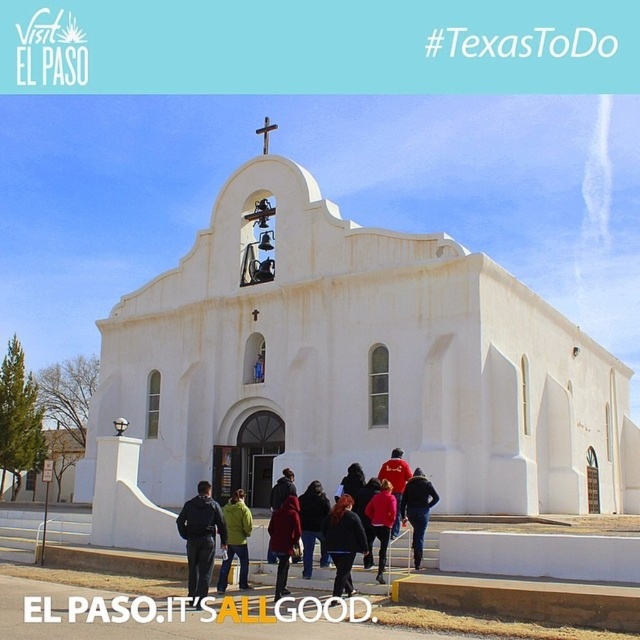
Question: Among these points, which one is nearest to the camera?

Choices:
 (A) (221, 586)
 (B) (326, 260)
 (C) (390, 502)

Answer: (A)

Question: Which point is farther from the camera taking this photo?

Choices:
 (A) (221, 593)
 (B) (198, 609)
 (C) (284, 541)
 (D) (400, 460)

Answer: (D)

Question: Which point is closer to the camera taking this photo?

Choices:
 (A) (189, 508)
 (B) (376, 493)
 (C) (388, 460)
 (D) (412, 477)

Answer: (A)

Question: Does dark red jacket at center appear under red matte jacket at center?

Choices:
 (A) no
 (B) yes

Answer: (B)

Question: Does red matte jacket at center have a greater width compared to matte red sweater at center?

Choices:
 (A) no
 (B) yes

Answer: (A)

Question: Can you confirm if red fabric jacket at center is positioned below red jacket at center?

Choices:
 (A) no
 (B) yes

Answer: (B)